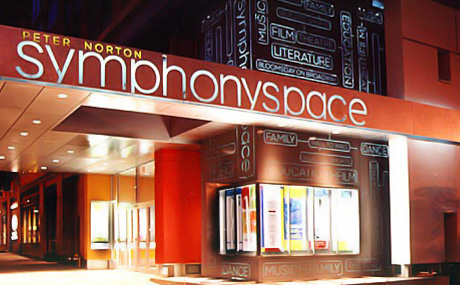
You are a GUI agent. You are given a task and a screenshot of the screen. Output one action in this format:
    pyautogui.click(x=<x>, y=<y>)
    Task: Click on the light
    Image resolution: width=460 pixels, height=285 pixels.
    Given the screenshot: What is the action you would take?
    pyautogui.click(x=271, y=196)